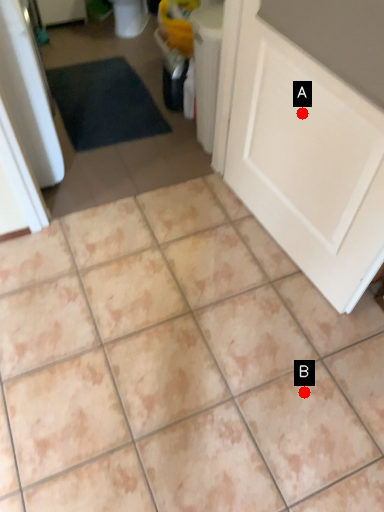
Question: Two points are circled on the image, labeled by A and B beside each circle. Which of the following is the closest to the observer?

Choices:
 (A) A is closer
 (B) B is closer

Answer: (A)